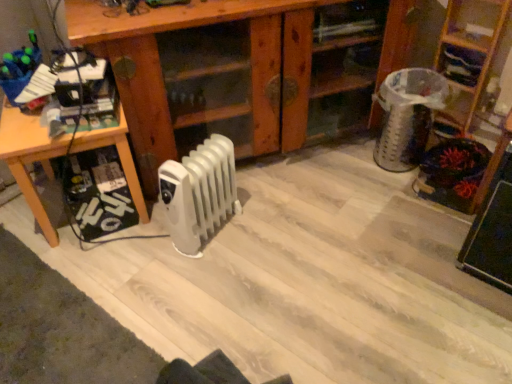
Question: Considering the positions of wooden table at left and wooden cabinet at center, acting as the 1th shelf starting from the left, in the image, is wooden table at left bigger or smaller than wooden cabinet at center, acting as the 1th shelf starting from the left,?

Choices:
 (A) big
 (B) small

Answer: (B)

Question: From the image's perspective, is wooden table at left above or below wooden cabinet at center, acting as the 1th shelf starting from the left?

Choices:
 (A) below
 (B) above

Answer: (A)

Question: Considering the real-world distances, which object is closest to the wooden bookshelf at upper right, which ranks as the second shelf in left-to-right order?

Choices:
 (A) wooden table at left
 (B) wooden bookshelf at upper right, the first shelf from the right
 (C) white plastic radiator at center
 (D) wooden cabinet at center, acting as the 1th shelf starting from the left

Answer: (B)

Question: Based on their relative distances, which object is nearer to the wooden table at left?

Choices:
 (A) wooden bookshelf at upper right, which ranks as the second shelf in left-to-right order
 (B) white plastic radiator at center
 (C) wooden bookshelf at upper right, the third shelf from the left
 (D) wooden cabinet at center, the 3th shelf positioned from the right

Answer: (B)